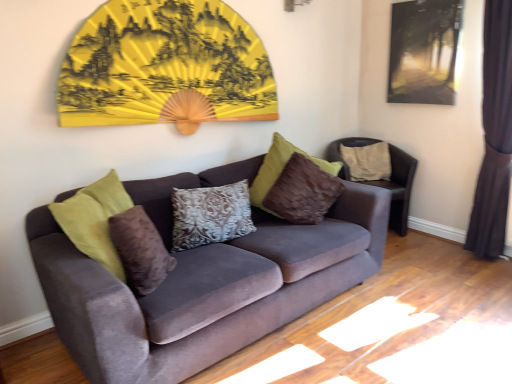
Question: Would you say velvet couch at center is outside velvet brown chair at right?

Choices:
 (A) yes
 (B) no

Answer: (A)

Question: Are velvet couch at center and velvet brown chair at right located far from each other?

Choices:
 (A) yes
 (B) no

Answer: (A)

Question: From the image's perspective, is velvet couch at center on top of velvet brown chair at right?

Choices:
 (A) yes
 (B) no

Answer: (B)

Question: Can you confirm if velvet couch at center is thinner than velvet brown chair at right?

Choices:
 (A) yes
 (B) no

Answer: (B)

Question: From a real-world perspective, is velvet couch at center on top of velvet brown chair at right?

Choices:
 (A) yes
 (B) no

Answer: (A)

Question: From the image's perspective, is beige fabric pillow at right, which is the third pillow from front to back, located above or below dark brown velvet curtain at right?

Choices:
 (A) above
 (B) below

Answer: (B)

Question: In terms of height, does beige fabric pillow at right, arranged as the first pillow when viewed from the back, look taller or shorter compared to dark brown velvet curtain at right?

Choices:
 (A) short
 (B) tall

Answer: (A)

Question: Is beige fabric pillow at right, arranged as the first pillow when viewed from the back, in front of or behind dark brown velvet curtain at right in the image?

Choices:
 (A) front
 (B) behind

Answer: (B)

Question: In terms of width, does beige fabric pillow at right, which ranks as the 1th pillow in right-to-left order, look wider or thinner when compared to dark brown velvet curtain at right?

Choices:
 (A) thin
 (B) wide

Answer: (B)

Question: Considering the relative positions of velvet couch at center and patterned fabric pillow at center, positioned as the 2th pillow in back-to-front order, in the image provided, is velvet couch at center to the left or to the right of patterned fabric pillow at center, positioned as the 2th pillow in back-to-front order,?

Choices:
 (A) left
 (B) right

Answer: (B)

Question: Does point pos(182,355) appear closer or farther from the camera than point pos(198,210)?

Choices:
 (A) closer
 (B) farther

Answer: (A)

Question: Considering their positions, is velvet couch at center located in front of or behind patterned fabric pillow at center, which is the second pillow from front to back?

Choices:
 (A) front
 (B) behind

Answer: (A)

Question: From a real-world perspective, relative to patterned fabric pillow at center, positioned as the 2th pillow in back-to-front order, is velvet couch at center vertically above or below?

Choices:
 (A) above
 (B) below

Answer: (B)

Question: Is point (393, 170) closer or farther from the camera than point (451, 9)?

Choices:
 (A) farther
 (B) closer

Answer: (A)

Question: Is velvet brown chair at right situated inside matte black picture frame at upper right or outside?

Choices:
 (A) outside
 (B) inside

Answer: (A)